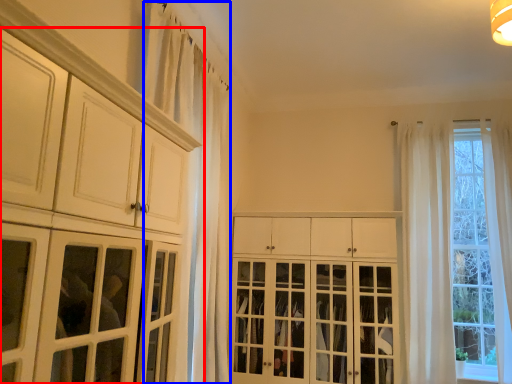
Question: Which point is closer to the camera, cabinetry (highlighted by a red box) or curtain (highlighted by a blue box)?

Choices:
 (A) cabinetry
 (B) curtain

Answer: (A)